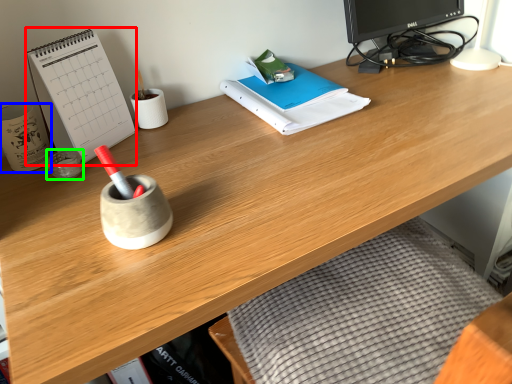
Question: Which object is positioned closest to paperback book (highlighted by a red box)? Select from stationery (highlighted by a blue box) and stationery (highlighted by a green box).

Choices:
 (A) stationery
 (B) stationery

Answer: (A)